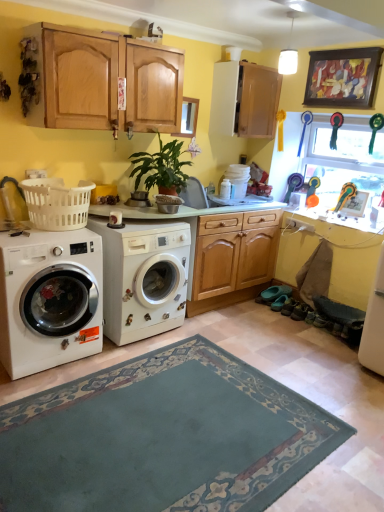
Question: Is translucent plastic window screen at upper right taller or shorter than green matte plant at center?

Choices:
 (A) tall
 (B) short

Answer: (A)

Question: Considering the positions of point (354, 154) and point (162, 186), is point (354, 154) closer or farther from the camera than point (162, 186)?

Choices:
 (A) farther
 (B) closer

Answer: (A)

Question: Which object is the farthest from the white glossy counter top at lower right?

Choices:
 (A) green matte plant at center
 (B) wooden cabinet at upper center
 (C) white matte washing machine at center, positioned as the 2th washing machine in left-to-right order
 (D) translucent plastic window screen at upper right
 (E) white matte washing machine at left, which is counted as the 1th washing machine, starting from the left

Answer: (E)

Question: Which is farther from the white matte washing machine at center, marked as the 1th washing machine in a right-to-left arrangement?

Choices:
 (A) white matte washing machine at left, arranged as the second washing machine when viewed from the right
 (B) white plastic laundry basket at left
 (C) white glossy counter top at lower right
 (D) translucent plastic window screen at upper right
 (E) wooden cabinet at upper center

Answer: (D)